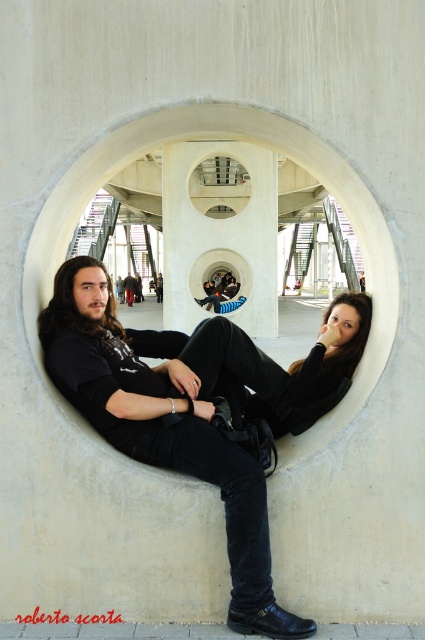
You are standing outside the circular opening and want to take a photo of the scene through the transparent glass hole at center. Where should you position yourself relative to the point marked as point (x=220, y=211) to ensure the entire scene is visible in your camera frame?

The point (x=220, y=211) marks the transparent glass hole at center, so positioning yourself directly in front of this point will allow you to capture the entire scene through the transparent glass hole at center.